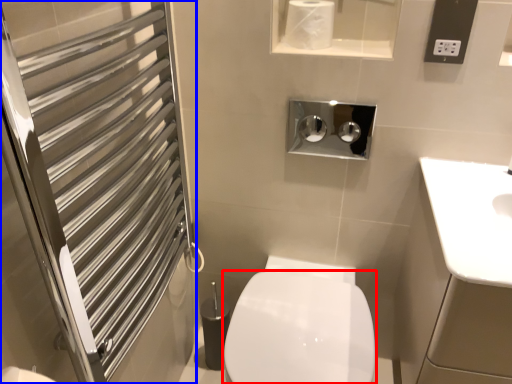
Question: Which point is closer to the camera, bidet (highlighted by a red box) or screen door (highlighted by a blue box)?

Choices:
 (A) bidet
 (B) screen door

Answer: (B)